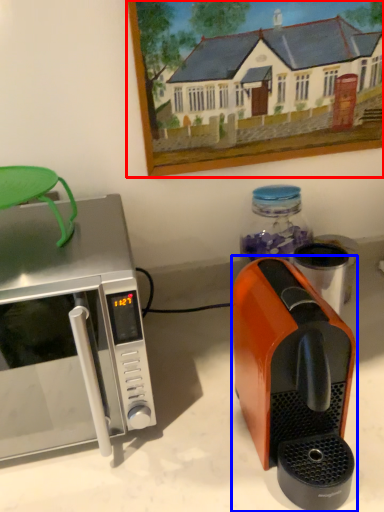
Question: Which point is closer to the camera, picture frame (highlighted by a red box) or coffee maker (highlighted by a blue box)?

Choices:
 (A) picture frame
 (B) coffee maker

Answer: (B)